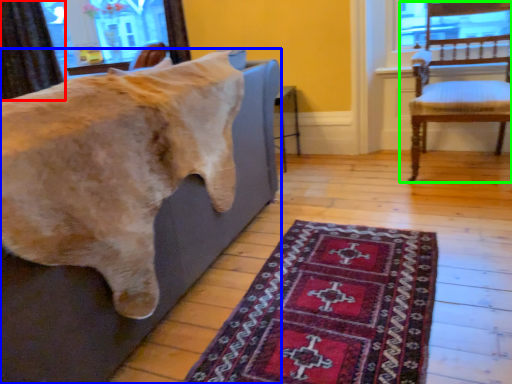
Question: Which object is positioned farthest from curtain (highlighted by a red box)? Select from furniture (highlighted by a blue box) and chair (highlighted by a green box).

Choices:
 (A) furniture
 (B) chair

Answer: (B)